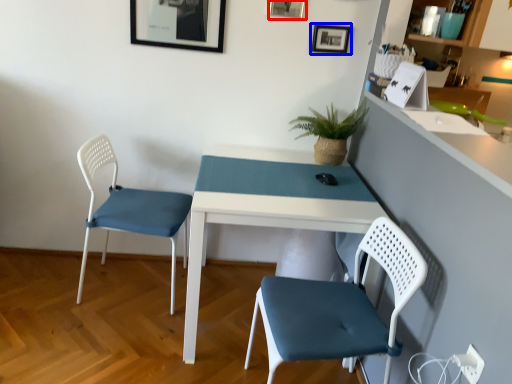
Question: Which object appears closest to the camera in this image, picture frame (highlighted by a red box) or picture frame (highlighted by a blue box)?

Choices:
 (A) picture frame
 (B) picture frame

Answer: (A)